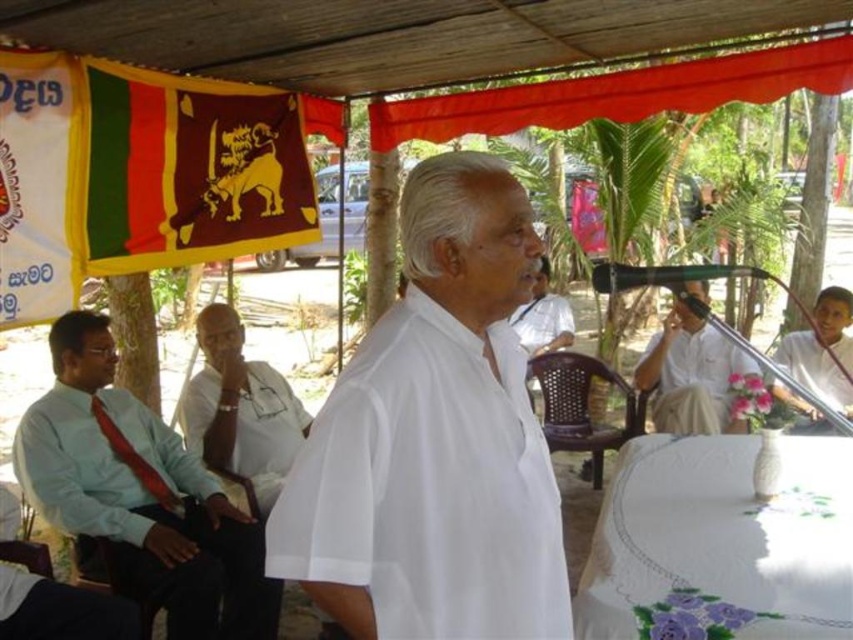
You are attending an outdoor event under a wooden canopy and notice two men in the scene. One is wearing a white matte shirt at center and the other a light blue shirt at left. Which man is wearing a smaller sized shirt?

The white matte shirt at center has a smaller size compared to the light blue shirt at left, so the man wearing the white matte shirt at center is the one with the smaller sized shirt.

You are an event planner looking at the outdoor setup. You need to place a new banner that should be above the white embroidered tablecloth at lower right but below the yellow fabric flag at upper left. Is this possible given their current positions?

The white embroidered tablecloth at lower right is located below the yellow fabric flag at upper left, so placing a banner above the tablecloth but below the flag is possible as they are vertically aligned with space between them.

You are attending an event under the wooden canopy and notice a matte fabric flag at upper center. Where exactly is this flag positioned in relation to the canopy and the speaker?

The matte fabric flag at upper center is positioned at coordinates point (618, 93), which places it near the top left area of the canopy relative to the speaker.